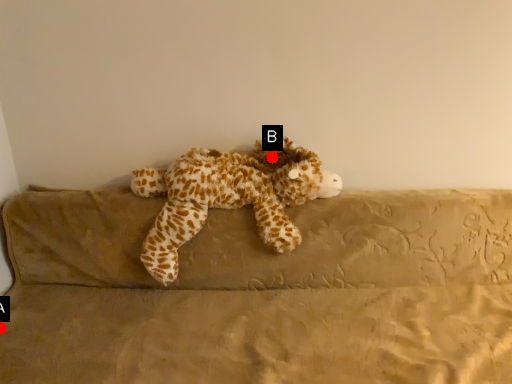
Question: Two points are circled on the image, labeled by A and B beside each circle. Which point is closer to the camera taking this photo?

Choices:
 (A) A is closer
 (B) B is closer

Answer: (A)